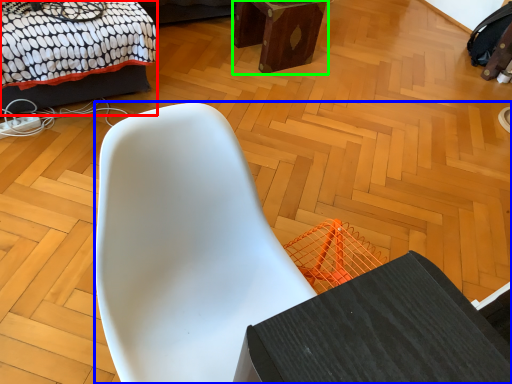
Question: Which is farther away from bed (highlighted by a red box)? chair (highlighted by a blue box) or furniture (highlighted by a green box)?

Choices:
 (A) chair
 (B) furniture

Answer: (A)